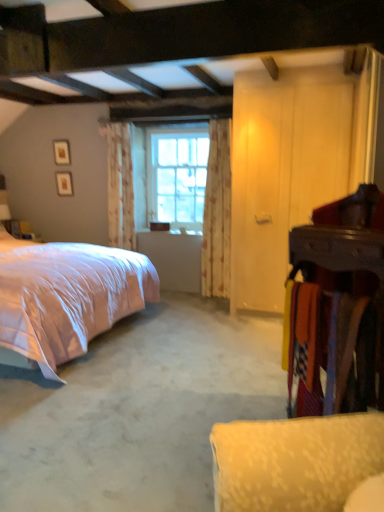
Question: Considering the positions of clear glass window at center and floral fabric curtain at center, which is counted as the 1th curtain, starting from the left, in the image, is clear glass window at center taller or shorter than floral fabric curtain at center, which is counted as the 1th curtain, starting from the left,?

Choices:
 (A) tall
 (B) short

Answer: (B)

Question: Considering the positions of point (182, 164) and point (109, 129), is point (182, 164) closer or farther from the camera than point (109, 129)?

Choices:
 (A) closer
 (B) farther

Answer: (B)

Question: Based on their relative distances, which object is nearer to the floral fabric curtain at center, placed as the 2th curtain when sorted from left to right?

Choices:
 (A) floral fabric curtain at center, acting as the 2th curtain starting from the right
 (B) pink satin bed at left
 (C) clear glass window at center
 (D) wooden armoire at right
 (E) white carpet at lower right

Answer: (C)

Question: Based on their relative distances, which object is farther from the pink satin bed at left?

Choices:
 (A) floral fabric curtain at center, placed as the 2th curtain when sorted from left to right
 (B) floral fabric curtain at center, acting as the 2th curtain starting from the right
 (C) white carpet at lower right
 (D) wooden armoire at right
 (E) clear glass window at center

Answer: (D)